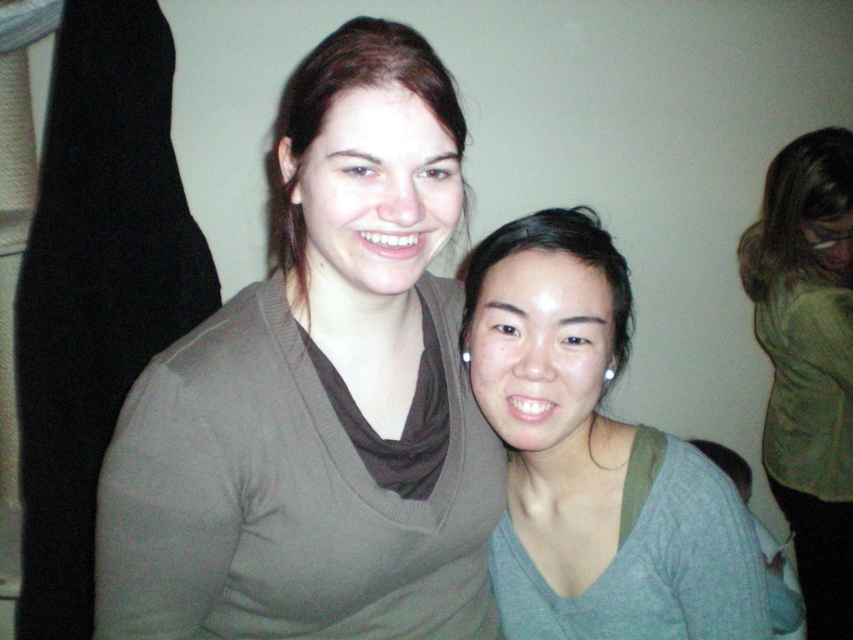
Can you confirm if matte brown sweater at upper left is bigger than gray matte sweater at center?

Indeed, matte brown sweater at upper left has a larger size compared to gray matte sweater at center.

Is matte brown sweater at upper left above gray matte sweater at center?

Yes, matte brown sweater at upper left is above gray matte sweater at center.

The width and height of the screenshot is (853, 640). I want to click on matte brown sweater at upper left, so click(x=318, y=396).

In order to click on green velvet sweater at upper right in this screenshot , I will do `click(808, 360)`.

Who is higher up, green velvet sweater at upper right or matte brown hair at upper center?

matte brown hair at upper center is above.

Does point (782, 484) lie in front of point (300, 157)?

No, it is behind (300, 157).

Where is `green velvet sweater at upper right`? green velvet sweater at upper right is located at coordinates (808, 360).

Is matte brown sweater at upper left taller than green velvet sweater at upper right?

No, matte brown sweater at upper left is not taller than green velvet sweater at upper right.

Can you confirm if matte brown sweater at upper left is bigger than green velvet sweater at upper right?

Actually, matte brown sweater at upper left might be smaller than green velvet sweater at upper right.

Is point (199, 365) positioned after point (846, 609)?

No, (199, 365) is closer to viewer.

I want to click on matte brown sweater at upper left, so click(318, 396).